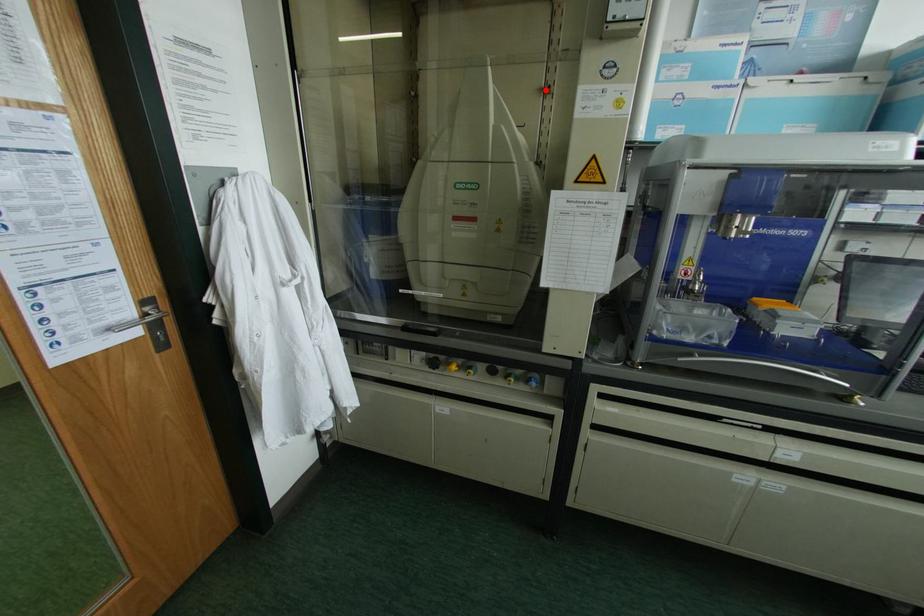
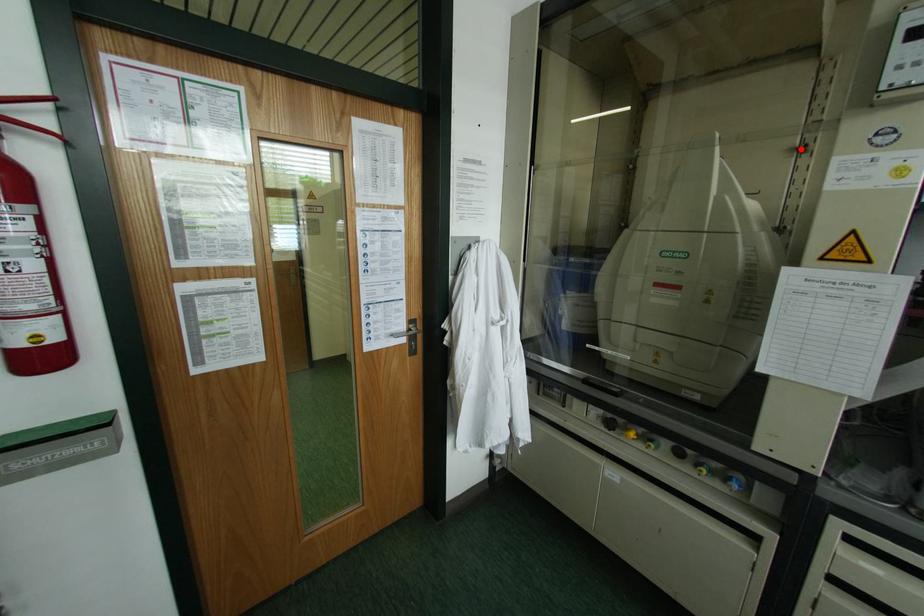
I am providing you with two images of the same scene from different viewpoints. A red point is marked on the first image and another point is marked on the second image. Does the point marked in image1 correspond to the same location as the one in image2?

Yes